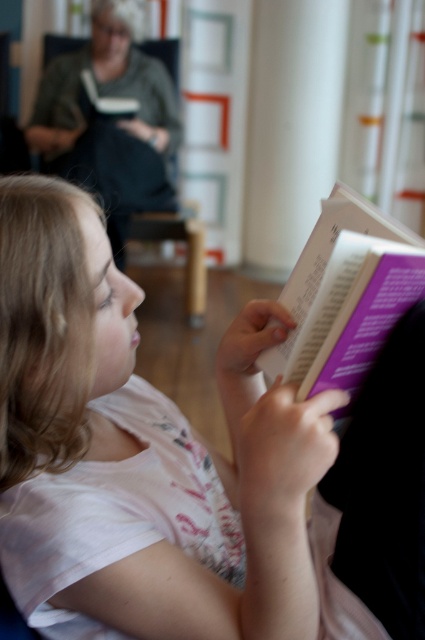
You are a tailor measuring the width of the white cotton shirt at center and the purple paper book at center. Which item has a larger width?

The white cotton shirt at center might be wider than purple paper book at center.

You are a photographer trying to capture a clear shot of the white cotton shirt at center and the purple paper book at center. Since the background is slightly out of focus, which object should you adjust your camera focus on to ensure both are in focus?

The white cotton shirt at center is positioned under the purple paper book at center, so adjusting focus on the white cotton shirt at center will ensure both are in focus as they are at the same distance from the camera.

You are standing in the library and want to take a photo of the two points in the image. The first point is at coordinate point (328, 252) and the second is at point (99, 182). Which point will appear larger in your photo?

Point (328, 252) is closer to the camera than point (99, 182), so it will appear larger in the photo.